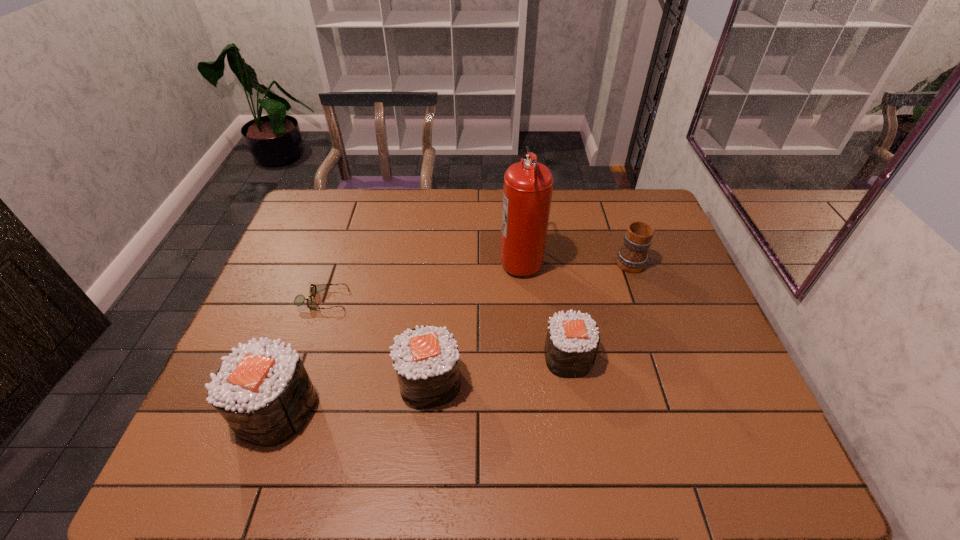
Select which sushi appears as the second closest to the second sushi from left to right. Please provide its 2D coordinates. Your answer should be formatted as a tuple, i.e. [(x, y)], where the tuple contains the x and y coordinates of a point satisfying the conditions above.

[(572, 340)]

Locate an element on the screen. This screenshot has height=540, width=960. vacant area in the image that satisfies the following two spatial constraints: 1. on the instruction side of the fire extinguisher; 2. on the front side of the third object from left to right is located at coordinates (532, 382).

This screenshot has width=960, height=540. I want to click on vacant region that satisfies the following two spatial constraints: 1. on the front-facing side of the fourth nearest object; 2. on the right side of the rightmost sushi, so click(x=304, y=357).

Identify the location of vacant region that satisfies the following two spatial constraints: 1. on the instruction side of the tallest object; 2. on the front side of the leftmost sushi. This screenshot has width=960, height=540. (535, 409).

In order to click on vacant space that satisfies the following two spatial constraints: 1. on the instruction side of the fire extinguisher; 2. on the right side of the rightmost sushi in this screenshot , I will do `click(530, 357)`.